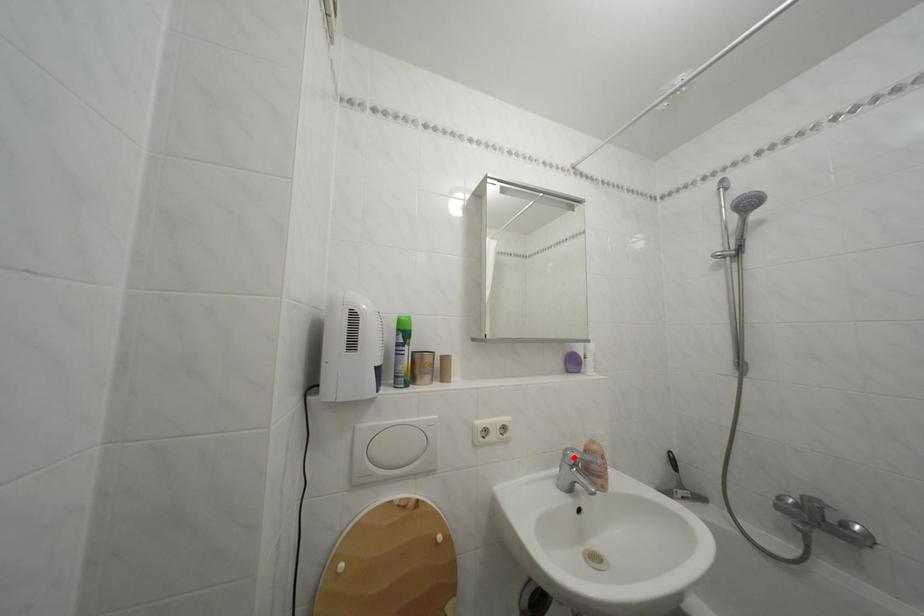
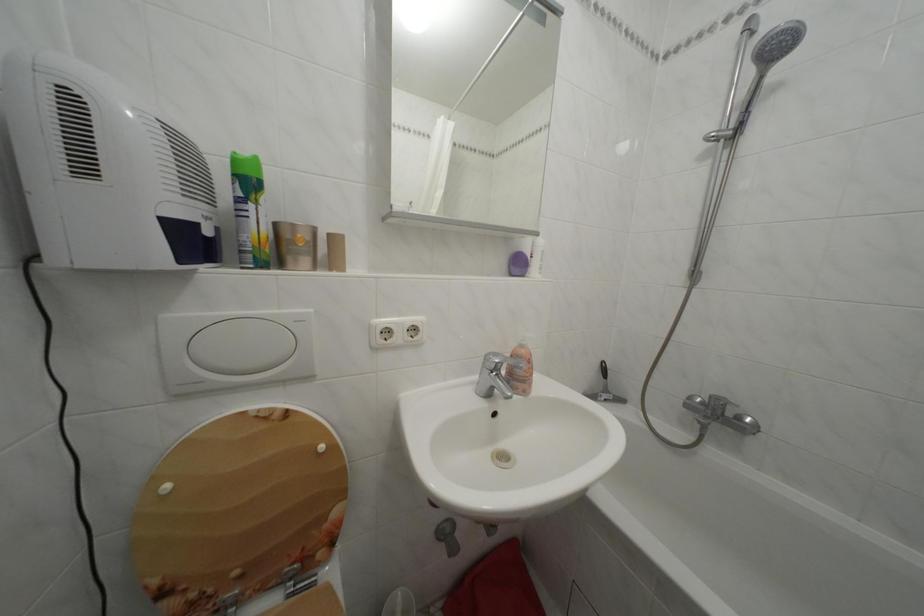
In the second image, find the point that corresponds to the highlighted location in the first image.

(495, 362)